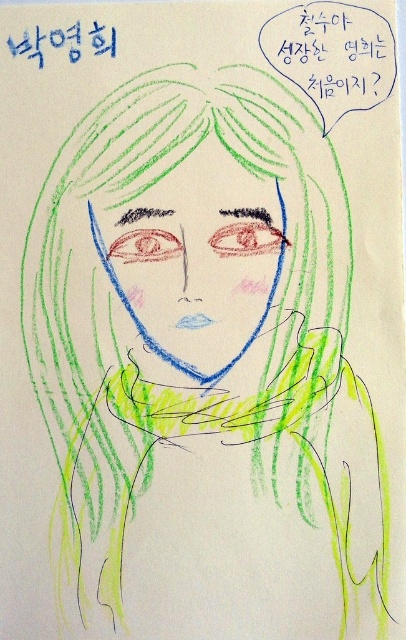
You are an art student analyzing this drawing. You notice the blue ink text at upper center and the black marker name at upper left. Which of these elements is located below the other?

The blue ink text at upper center is positioned under the black marker name at upper left.

You are an artist trying to replicate this drawing. The point at point (95, 28) is part of the figure. If you want to draw a line from the point to the edge of the paper, how long should the line be?

The line from the point at point (95, 28) to the edge of the paper should be 26.23 inches long.